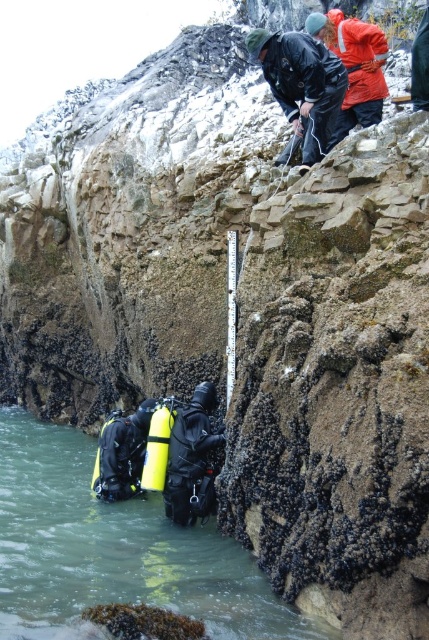
Question: Does black matte jacket at center appear over yellow matte scuba tank at lower center?

Choices:
 (A) no
 (B) yes

Answer: (B)

Question: Which point is closer to the camera?

Choices:
 (A) (168, 429)
 (B) (374, 45)
 (C) (236, 252)
 (D) (277, 620)

Answer: (D)

Question: Can you confirm if black matte jacket at center is thinner than metallic silver rod at center?

Choices:
 (A) no
 (B) yes

Answer: (A)

Question: Which object appears farthest from the camera in this image?

Choices:
 (A) yellow matte scuba tank at lower center
 (B) green matte water at lower left
 (C) orange waterproof jacket at upper right
 (D) metallic silver rod at center

Answer: (A)

Question: Is black matte jacket at center behind orange waterproof jacket at upper right?

Choices:
 (A) no
 (B) yes

Answer: (A)

Question: Based on their relative distances, which object is farther from the black matte jacket at center?

Choices:
 (A) orange waterproof jacket at upper right
 (B) green matte water at lower left
 (C) yellow matte scuba tank at lower center

Answer: (B)